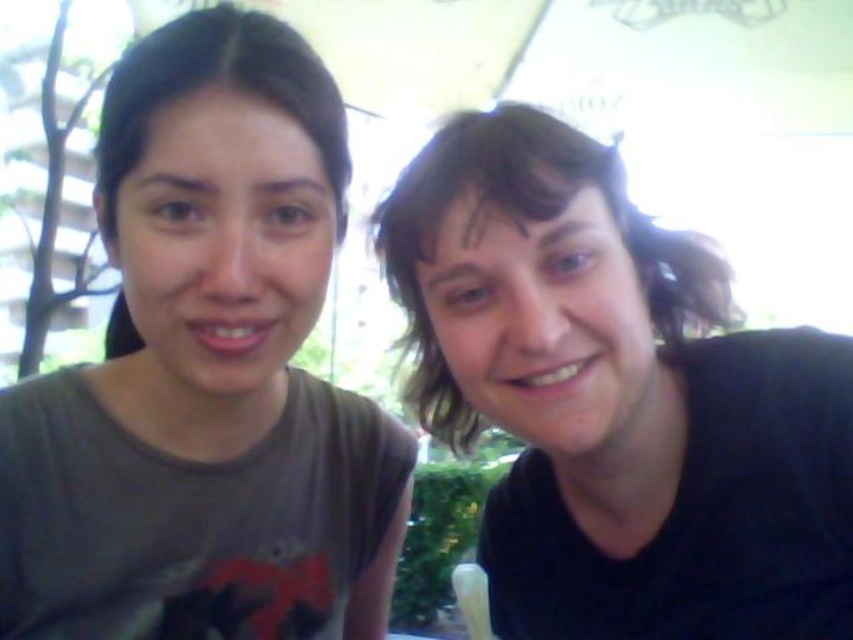
Question: Does gray matte t-shirt at left have a greater width compared to black matte shirt at right?

Choices:
 (A) no
 (B) yes

Answer: (A)

Question: Which object is farther from the camera taking this photo?

Choices:
 (A) gray matte t-shirt at left
 (B) black matte shirt at right

Answer: (A)

Question: Among these objects, which one is nearest to the camera?

Choices:
 (A) black matte shirt at right
 (B) gray matte t-shirt at left

Answer: (A)

Question: Does gray matte t-shirt at left have a larger size compared to black matte shirt at right?

Choices:
 (A) yes
 (B) no

Answer: (A)

Question: Is gray matte t-shirt at left above black matte shirt at right?

Choices:
 (A) yes
 (B) no

Answer: (B)